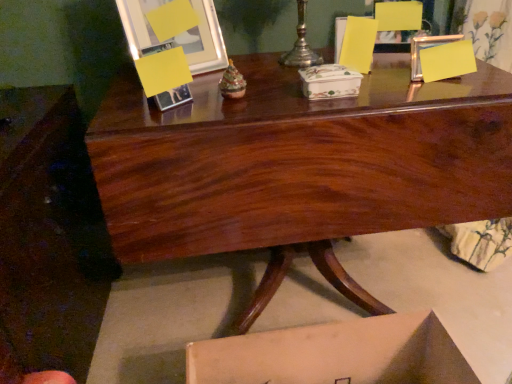
Question: Is silver metallic candle holder at upper center further to camera compared to porcelain floral box at center?

Choices:
 (A) no
 (B) yes

Answer: (B)

Question: Is silver metallic candle holder at upper center to the left of porcelain floral box at center from the viewer's perspective?

Choices:
 (A) no
 (B) yes

Answer: (B)

Question: From the image's perspective, is silver metallic candle holder at upper center located above porcelain floral box at center?

Choices:
 (A) yes
 (B) no

Answer: (A)

Question: Are silver metallic candle holder at upper center and porcelain floral box at center located far from each other?

Choices:
 (A) yes
 (B) no

Answer: (B)

Question: Considering the relative sizes of silver metallic candle holder at upper center and porcelain floral box at center in the image provided, is silver metallic candle holder at upper center smaller than porcelain floral box at center?

Choices:
 (A) no
 (B) yes

Answer: (A)

Question: Can you confirm if silver metallic candle holder at upper center is thinner than porcelain floral box at center?

Choices:
 (A) no
 (B) yes

Answer: (A)

Question: Is silver metallic candle holder at upper center bigger than metallic silver picture frame at upper left?

Choices:
 (A) no
 (B) yes

Answer: (A)

Question: Does silver metallic candle holder at upper center have a greater width compared to metallic silver picture frame at upper left?

Choices:
 (A) yes
 (B) no

Answer: (A)

Question: Does silver metallic candle holder at upper center appear on the left side of metallic silver picture frame at upper left?

Choices:
 (A) yes
 (B) no

Answer: (B)

Question: Are silver metallic candle holder at upper center and metallic silver picture frame at upper left beside each other?

Choices:
 (A) yes
 (B) no

Answer: (B)

Question: Does silver metallic candle holder at upper center have a lesser height compared to metallic silver picture frame at upper left?

Choices:
 (A) yes
 (B) no

Answer: (A)

Question: From the image's perspective, would you say silver metallic candle holder at upper center is shown under metallic silver picture frame at upper left?

Choices:
 (A) yes
 (B) no

Answer: (B)

Question: Is the position of metallic silver picture frame at upper left more distant than that of glossy wood desk at center?

Choices:
 (A) yes
 (B) no

Answer: (A)